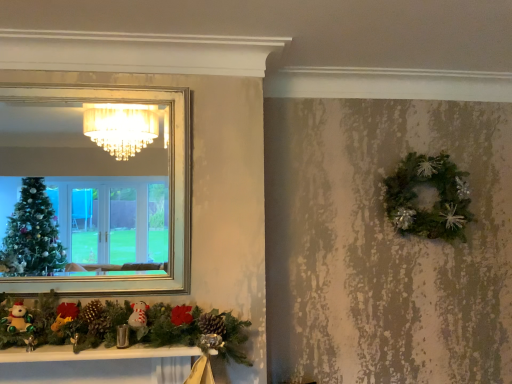
What do you see at coordinates (434, 202) in the screenshot? I see `green textured wreath at upper right` at bounding box center [434, 202].

This screenshot has width=512, height=384. I want to click on green textured wreath at upper right, so click(x=434, y=202).

Measure the distance between green textured wreath at upper right and camera.

A distance of 7.55 feet exists between green textured wreath at upper right and camera.

Locate an element on the screen. This screenshot has height=384, width=512. green textured wreath at upper right is located at coordinates (434, 202).